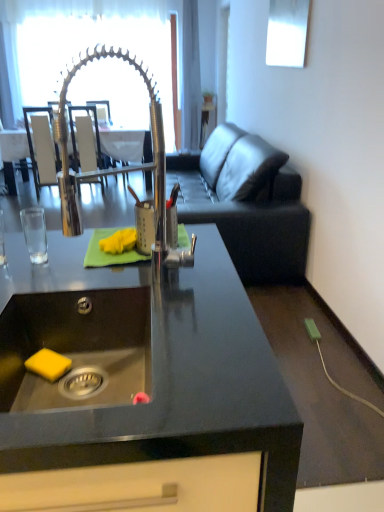
Question: Is polished chrome tap at center taller than dark gray leather couch at right?

Choices:
 (A) yes
 (B) no

Answer: (B)

Question: Considering the relative sizes of polished chrome tap at center and dark gray leather couch at right in the image provided, is polished chrome tap at center thinner than dark gray leather couch at right?

Choices:
 (A) yes
 (B) no

Answer: (A)

Question: Is the surface of polished chrome tap at center in direct contact with dark gray leather couch at right?

Choices:
 (A) no
 (B) yes

Answer: (A)

Question: Can you confirm if polished chrome tap at center is positioned to the right of dark gray leather couch at right?

Choices:
 (A) yes
 (B) no

Answer: (B)

Question: Are polished chrome tap at center and dark gray leather couch at right far apart?

Choices:
 (A) yes
 (B) no

Answer: (A)

Question: Is polished chrome tap at center positioned beyond the bounds of dark gray leather couch at right?

Choices:
 (A) yes
 (B) no

Answer: (A)

Question: Is the depth of polished chrome tap at center less than that of clear glass door at upper center?

Choices:
 (A) yes
 (B) no

Answer: (A)

Question: Is polished chrome tap at center smaller than clear glass door at upper center?

Choices:
 (A) no
 (B) yes

Answer: (B)

Question: From a real-world perspective, is polished chrome tap at center under clear glass door at upper center?

Choices:
 (A) no
 (B) yes

Answer: (B)

Question: Is clear glass door at upper center inside polished chrome tap at center?

Choices:
 (A) no
 (B) yes

Answer: (A)

Question: From a real-world perspective, is polished chrome tap at center physically above clear glass door at upper center?

Choices:
 (A) yes
 (B) no

Answer: (B)

Question: Considering the relative positions of polished chrome tap at center and clear glass door at upper center in the image provided, is polished chrome tap at center behind clear glass door at upper center?

Choices:
 (A) yes
 (B) no

Answer: (B)

Question: Considering the relative sizes of dark gray leather couch at right and white leather armchair at upper left, which is the 2th armchair in right-to-left order, in the image provided, is dark gray leather couch at right taller than white leather armchair at upper left, which is the 2th armchair in right-to-left order,?

Choices:
 (A) no
 (B) yes

Answer: (A)